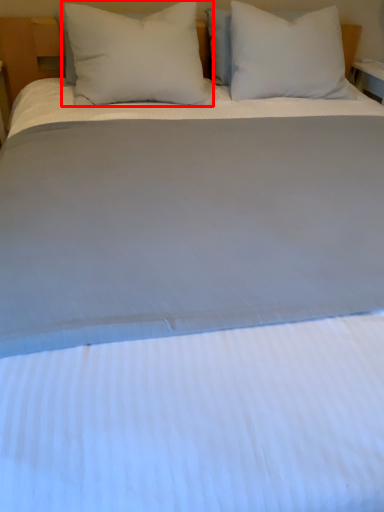
Question: From the image's perspective, what is the correct spatial relationship of pillow (annotated by the red box) in relation to pillow?

Choices:
 (A) below
 (B) above

Answer: (A)